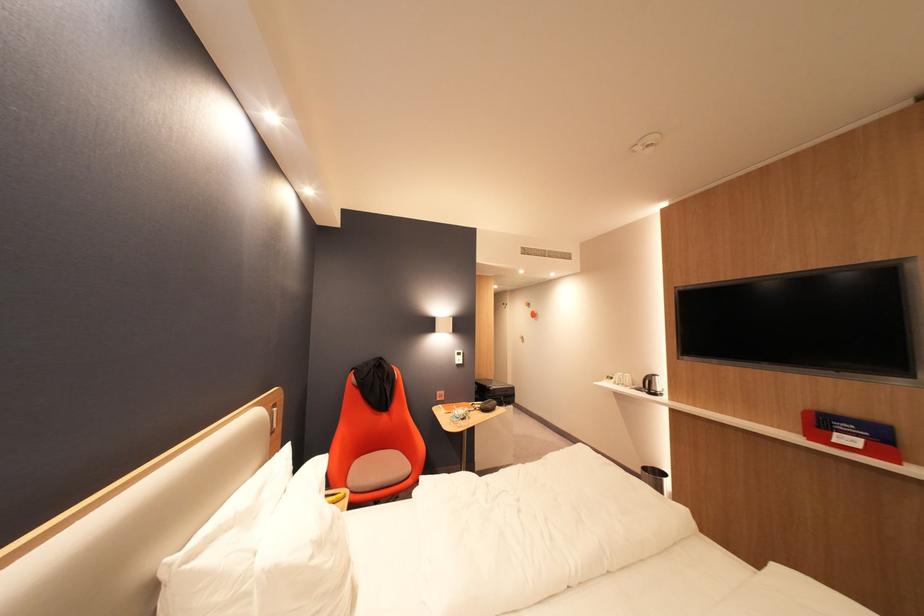
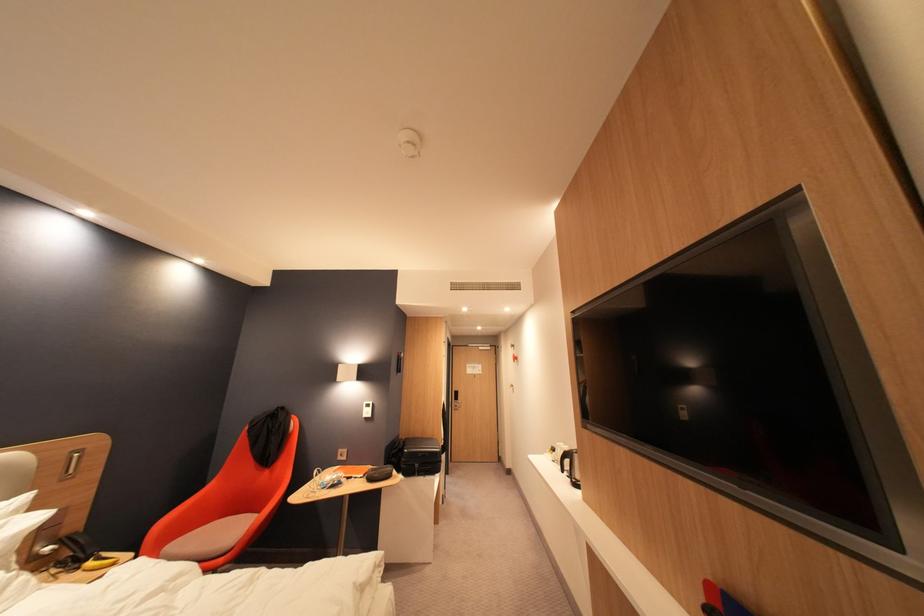
Find the pixel in the second image that matches pixel 611 383 in the first image.

(553, 455)